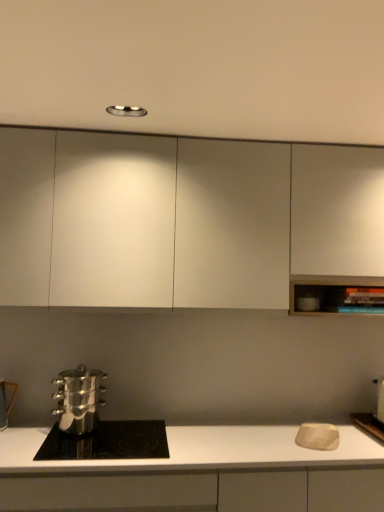
Question: Should I look upward or downward to see metallic silver pot at lower left, positioned as the first appliance in left-to-right order?

Choices:
 (A) down
 (B) up

Answer: (A)

Question: Is matte white cutting board at right, positioned as the 1th appliance in right-to-left order, completely or partially inside white matte countertop at lower center, acting as the first cabinetry starting from the bottom?

Choices:
 (A) no
 (B) yes

Answer: (A)

Question: Considering the relative sizes of white matte countertop at lower center, acting as the first cabinetry starting from the bottom, and matte white cutting board at right, the 2th appliance from the left, in the image provided, is white matte countertop at lower center, acting as the first cabinetry starting from the bottom, shorter than matte white cutting board at right, the 2th appliance from the left,?

Choices:
 (A) yes
 (B) no

Answer: (B)

Question: From a real-world perspective, does white matte countertop at lower center, acting as the first cabinetry starting from the bottom, sit lower than matte white cutting board at right, positioned as the 1th appliance in right-to-left order?

Choices:
 (A) yes
 (B) no

Answer: (A)

Question: From a real-world perspective, does white matte countertop at lower center, placed as the 2th cabinetry when sorted from top to bottom, stand above matte white cutting board at right, positioned as the 1th appliance in right-to-left order?

Choices:
 (A) no
 (B) yes

Answer: (A)

Question: From the image's perspective, is white matte countertop at lower center, placed as the 2th cabinetry when sorted from top to bottom, located above matte white cutting board at right, the 2th appliance from the left?

Choices:
 (A) no
 (B) yes

Answer: (A)

Question: Is white matte countertop at lower center, placed as the 2th cabinetry when sorted from top to bottom, oriented towards matte white cutting board at right, the 2th appliance from the left?

Choices:
 (A) yes
 (B) no

Answer: (B)

Question: From the image's perspective, is metallic silver pot at lower left, which is the second appliance from right to left, below polished stainless steel pot at lower left?

Choices:
 (A) no
 (B) yes

Answer: (A)

Question: Can you confirm if metallic silver pot at lower left, positioned as the first appliance in left-to-right order, is positioned to the right of polished stainless steel pot at lower left?

Choices:
 (A) yes
 (B) no

Answer: (B)

Question: Does metallic silver pot at lower left, which is the second appliance from right to left, have a lesser height compared to polished stainless steel pot at lower left?

Choices:
 (A) yes
 (B) no

Answer: (B)

Question: Is polished stainless steel pot at lower left completely or partially inside metallic silver pot at lower left, which is the second appliance from right to left?

Choices:
 (A) no
 (B) yes

Answer: (A)

Question: Is metallic silver pot at lower left, positioned as the first appliance in left-to-right order, positioned beyond the bounds of polished stainless steel pot at lower left?

Choices:
 (A) no
 (B) yes

Answer: (B)

Question: Is metallic silver pot at lower left, which is the second appliance from right to left, smaller than polished stainless steel pot at lower left?

Choices:
 (A) yes
 (B) no

Answer: (A)

Question: From a real-world perspective, is matte white cutting board at right, positioned as the 1th appliance in right-to-left order, over metallic silver pot at lower left, positioned as the first appliance in left-to-right order?

Choices:
 (A) no
 (B) yes

Answer: (B)